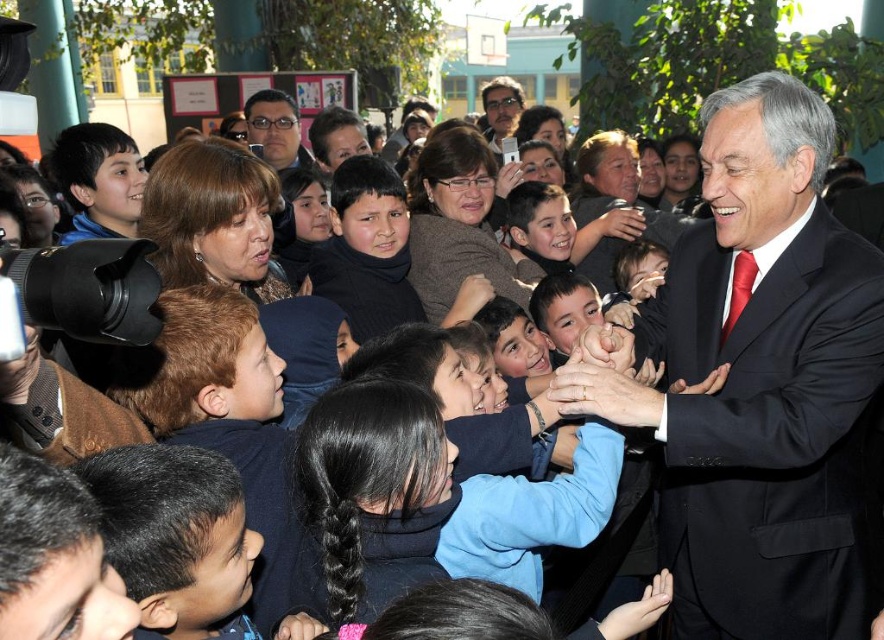
You are a photographer at the event and want to ensure both the blue fleece jacket at center and the matte black glasses at center are clearly visible in your photo. Given their sizes, which object might you need to adjust your focus on to capture more detail?

The blue fleece jacket at center is much taller than the matte black glasses at center, so you might need to adjust focus on the matte black glasses at center to capture its details since it is smaller.

You are a photographer standing at the edge of the scene. You want to take a photo that includes both the blue fleece jacket at center and the dark brown sweater at center. What is the minimum distance you need to move backward to ensure both are in frame?

The blue fleece jacket at center is 8.40 meters from the dark brown sweater at center. To include both in the frame, you need to move back at least 8.40 meters to ensure both are visible.

You are a tailor who needs to determine which garment requires more fabric to make between the blue fleece jacket at center and the dark brown sweater at center. Which one would need more fabric?

The dark brown sweater at center requires more fabric because it is thicker than the blue fleece jacket at center.